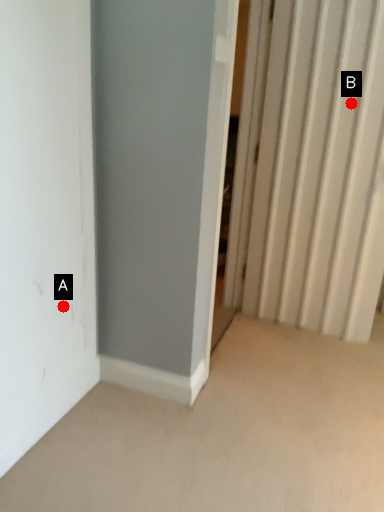
Question: Two points are circled on the image, labeled by A and B beside each circle. Which point is closer to the camera taking this photo?

Choices:
 (A) A is closer
 (B) B is closer

Answer: (A)